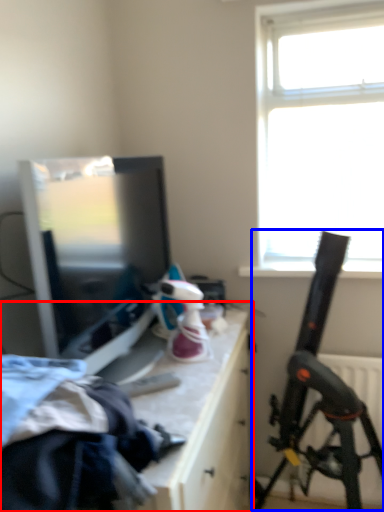
Question: Which point is closer to the camera, table (highlighted by a red box) or weapon (highlighted by a blue box)?

Choices:
 (A) table
 (B) weapon

Answer: (A)